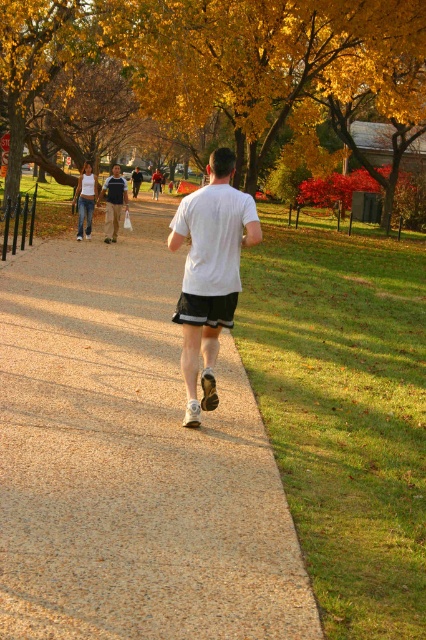
Is white matte shirt at center below white cotton tank top at center?

Yes, white matte shirt at center is below white cotton tank top at center.

Is point (189, 296) more distant than point (94, 200)?

That is False.

Locate an element on the screen. This screenshot has height=640, width=426. white matte shirt at center is located at coordinates (210, 273).

Between point (17, 467) and point (170, 28), which one is positioned in front?

Point (17, 467) is more forward.

Is point (112, 544) positioned behind point (43, 65)?

No, it is in front of (43, 65).

What do you see at coordinates (131, 460) in the screenshot? Image resolution: width=426 pixels, height=640 pixels. I see `smooth concrete sidewalk at center` at bounding box center [131, 460].

Image resolution: width=426 pixels, height=640 pixels. I want to click on smooth concrete sidewalk at center, so 131,460.

Can you confirm if yellow leafy tree at upper center is shorter than white cotton tank top at center?

No.

Can you confirm if yellow leafy tree at upper center is taller than white cotton tank top at center?

Indeed, yellow leafy tree at upper center has a greater height compared to white cotton tank top at center.

Locate an element on the screen. The height and width of the screenshot is (640, 426). yellow leafy tree at upper center is located at coordinates (232, 65).